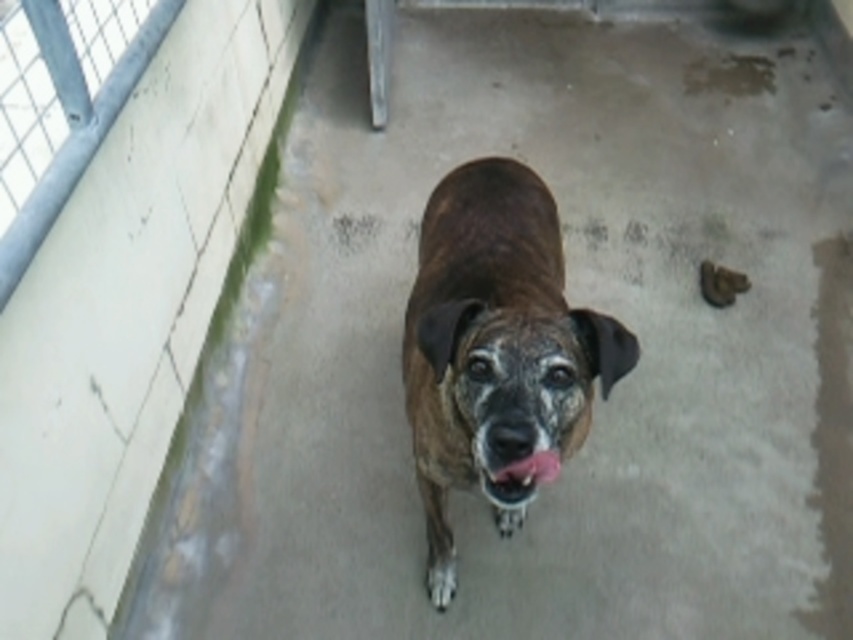
Is brown fur dog at center further to the viewer compared to pink glossy tongue at center?

No, brown fur dog at center is closer to the viewer.

In the scene shown: Does brown fur dog at center lie in front of pink glossy tongue at center?

Yes.

Is point (438, 509) closer to viewer compared to point (523, 484)?

No, it is behind (523, 484).

I want to click on brown fur dog at center, so click(x=495, y=348).